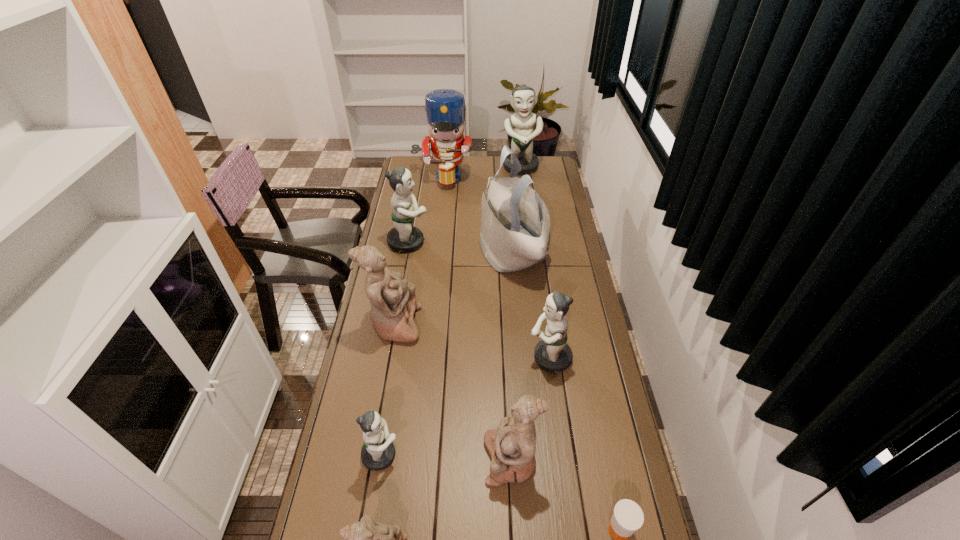
Select which green figurine appears as the second closest to the second nearest green figurine. Please provide its 2D coordinates. Your answer should be formatted as a tuple, i.e. [(x, y)], where the tuple contains the x and y coordinates of a point satisfying the conditions above.

[(405, 238)]

At what (x,y) coordinates should I click in order to perform the action: click on the fourth closest green figurine to the smallest white figurine. Please return your answer as a coordinate pair (x, y). The height and width of the screenshot is (540, 960). Looking at the image, I should click on (521, 126).

Identify which white figurine is located as the third nearest to the third smallest green figurine. Please provide its 2D coordinates. Your answer should be formatted as a tuple, i.e. [(x, y)], where the tuple contains the x and y coordinates of a point satisfying the conditions above.

[(367, 539)]

You are a GUI agent. You are given a task and a screenshot of the screen. Output one action in this format:
    pyautogui.click(x=<x>, y=<y>)
    Task: Click on the white figurine identified as the second closest to the second nearest green figurine
    
    Given the screenshot: What is the action you would take?
    pyautogui.click(x=393, y=302)